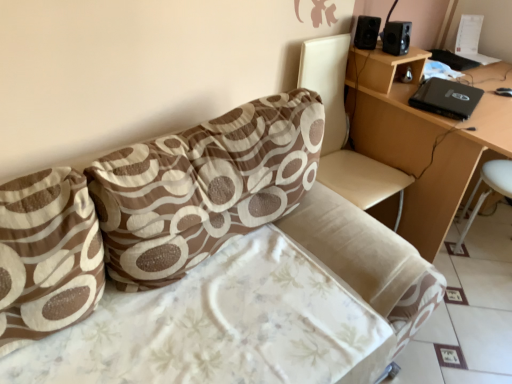
Where is `brown printed fabric pillow at upper center, the first pillow positioned from the right`? This screenshot has width=512, height=384. brown printed fabric pillow at upper center, the first pillow positioned from the right is located at coordinates (204, 187).

Identify the location of black matte laptop at upper right. (446, 98).

I want to click on beige leather swivel chair at upper right, so click(x=344, y=130).

Locate an element on the screen. The image size is (512, 384). light brown wooden table at upper right is located at coordinates (424, 139).

What do you see at coordinates (487, 191) in the screenshot? The width and height of the screenshot is (512, 384). I see `white plastic bar stool at lower right` at bounding box center [487, 191].

In order to click on white plastic bar stool at lower right in this screenshot , I will do `click(487, 191)`.

Find the location of a particular element. brown fabric couch at center is located at coordinates (205, 263).

Is black plastic speaker at upper right, which is the 1th speaker in right-to-left order, looking in the opposite direction of black matte speaker at upper right, which is the first speaker from left to right?

Yes.

Is black plastic speaker at upper right, placed as the 2th speaker when sorted from left to right, bigger than black matte speaker at upper right, which is the 2th speaker in right-to-left order?

No, black plastic speaker at upper right, placed as the 2th speaker when sorted from left to right, is not bigger than black matte speaker at upper right, which is the 2th speaker in right-to-left order.

Based on the photo, which object is closer to the camera, black plastic speaker at upper right, placed as the 2th speaker when sorted from left to right, or black matte speaker at upper right, which is the 2th speaker in right-to-left order?

black plastic speaker at upper right, placed as the 2th speaker when sorted from left to right, is closer to the camera.

From the picture: Considering the relative sizes of black plastic speaker at upper right, placed as the 2th speaker when sorted from left to right, and black matte speaker at upper right, which is the first speaker from left to right, in the image provided, is black plastic speaker at upper right, placed as the 2th speaker when sorted from left to right, taller than black matte speaker at upper right, which is the first speaker from left to right,?

Indeed, black plastic speaker at upper right, placed as the 2th speaker when sorted from left to right, has a greater height compared to black matte speaker at upper right, which is the first speaker from left to right.

Who is more distant, beige leather swivel chair at upper right or brown printed fabric pillow at left, positioned as the second pillow in right-to-left order?

beige leather swivel chair at upper right is behind.

Is beige leather swivel chair at upper right bigger than brown printed fabric pillow at left, the 1th pillow positioned from the left?

Yes, beige leather swivel chair at upper right is bigger than brown printed fabric pillow at left, the 1th pillow positioned from the left.

How many degrees apart are the facing directions of beige leather swivel chair at upper right and brown printed fabric pillow at left, the 1th pillow positioned from the left?

There is a 0.87-degree angle between the facing directions of beige leather swivel chair at upper right and brown printed fabric pillow at left, the 1th pillow positioned from the left.

Between point (322, 98) and point (45, 234), which one is positioned in front?

Positioned in front is point (45, 234).

Which of these two, brown fabric couch at center or brown printed fabric pillow at upper center, placed as the 2th pillow when sorted from left to right, is bigger?

With larger size is brown fabric couch at center.

Consider the image. Considering the sizes of objects brown fabric couch at center and brown printed fabric pillow at upper center, placed as the 2th pillow when sorted from left to right, in the image provided, who is wider, brown fabric couch at center or brown printed fabric pillow at upper center, placed as the 2th pillow when sorted from left to right,?

brown fabric couch at center is wider.

Is brown fabric couch at center facing towards brown printed fabric pillow at upper center, the first pillow positioned from the right?

No, brown fabric couch at center is not oriented towards brown printed fabric pillow at upper center, the first pillow positioned from the right.

Measure the distance from brown fabric couch at center to brown printed fabric pillow at upper center, the first pillow positioned from the right.

brown fabric couch at center is 4.00 inches away from brown printed fabric pillow at upper center, the first pillow positioned from the right.

From a real-world perspective, between black matte speaker at upper right, which is the 2th speaker in right-to-left order, and beige leather swivel chair at upper right, who is vertically lower?

beige leather swivel chair at upper right is physically lower.

Is black matte speaker at upper right, which is the 2th speaker in right-to-left order, at the left side of beige leather swivel chair at upper right?

Incorrect, black matte speaker at upper right, which is the 2th speaker in right-to-left order, is not on the left side of beige leather swivel chair at upper right.

From a real-world perspective, which speaker is the 1st one above the beige leather swivel chair at upper right? Please provide its 2D coordinates.

[(367, 32)]

From the image's perspective, is black matte speaker at upper right, which is the 2th speaker in right-to-left order, above or below beige leather swivel chair at upper right?

Based on their image positions, black matte speaker at upper right, which is the 2th speaker in right-to-left order, is located above beige leather swivel chair at upper right.

Which object is positioned more to the left, brown printed fabric pillow at left, positioned as the second pillow in right-to-left order, or black plastic speaker at upper right, placed as the 2th speaker when sorted from left to right?

Positioned to the left is brown printed fabric pillow at left, positioned as the second pillow in right-to-left order.

From the image's perspective, between brown printed fabric pillow at left, positioned as the second pillow in right-to-left order, and black plastic speaker at upper right, which is the 1th speaker in right-to-left order, who is located below?

brown printed fabric pillow at left, positioned as the second pillow in right-to-left order.

Considering the relative sizes of brown printed fabric pillow at left, the 1th pillow positioned from the left, and black plastic speaker at upper right, which is the 1th speaker in right-to-left order, in the image provided, is brown printed fabric pillow at left, the 1th pillow positioned from the left, wider than black plastic speaker at upper right, which is the 1th speaker in right-to-left order,?

Correct, the width of brown printed fabric pillow at left, the 1th pillow positioned from the left, exceeds that of black plastic speaker at upper right, which is the 1th speaker in right-to-left order.

From the image's perspective, which pillow is the 2nd one below the black plastic speaker at upper right, which is the 1th speaker in right-to-left order? Please provide its 2D coordinates.

[(47, 255)]

Choose the correct answer: Is light brown wooden table at upper right inside black plastic speaker at upper right, placed as the 2th speaker when sorted from left to right, or outside it?

light brown wooden table at upper right is spatially situated outside black plastic speaker at upper right, placed as the 2th speaker when sorted from left to right.

How many degrees apart are the facing directions of light brown wooden table at upper right and black plastic speaker at upper right, which is the 1th speaker in right-to-left order?

light brown wooden table at upper right and black plastic speaker at upper right, which is the 1th speaker in right-to-left order, are facing 0.249 degrees away from each other.

Considering the sizes of light brown wooden table at upper right and black plastic speaker at upper right, placed as the 2th speaker when sorted from left to right, in the image, is light brown wooden table at upper right wider or thinner than black plastic speaker at upper right, placed as the 2th speaker when sorted from left to right,?

Considering their sizes, light brown wooden table at upper right looks broader than black plastic speaker at upper right, placed as the 2th speaker when sorted from left to right.

From a real-world perspective, which is physically below, light brown wooden table at upper right or black plastic speaker at upper right, placed as the 2th speaker when sorted from left to right?

light brown wooden table at upper right.

Between black matte laptop at upper right and brown printed fabric pillow at left, the 1th pillow positioned from the left, which one has larger width?

With larger width is black matte laptop at upper right.

There is a black matte laptop at upper right. Where is `the 2nd pillow below it (from the image's perspective)`? The height and width of the screenshot is (384, 512). the 2nd pillow below it (from the image's perspective) is located at coordinates (47, 255).

What's the angular difference between black matte laptop at upper right and brown printed fabric pillow at left, the 1th pillow positioned from the left,'s facing directions?

There is a 16.2-degree angle between the facing directions of black matte laptop at upper right and brown printed fabric pillow at left, the 1th pillow positioned from the left.

Does point (466, 104) appear closer or farther from the camera than point (0, 335)?

Clearly, point (466, 104) is more distant from the camera than point (0, 335).

Find the location of a particular element. speaker below the black matte speaker at upper right, which is the 2th speaker in right-to-left order (from the image's perspective) is located at coordinates (396, 37).

From a real-world perspective, count 1st pillows upward from the beige leather swivel chair at upper right and point to it. Please provide its 2D coordinates.

[(47, 255)]

Which object lies further to the anchor point brown printed fabric pillow at upper center, placed as the 2th pillow when sorted from left to right, beige leather swivel chair at upper right or brown printed fabric pillow at left, positioned as the second pillow in right-to-left order?

Based on the image, beige leather swivel chair at upper right appears to be further to brown printed fabric pillow at upper center, placed as the 2th pillow when sorted from left to right.

Based on their spatial positions, is beige leather swivel chair at upper right or white plastic bar stool at lower right closer to brown printed fabric pillow at left, the 1th pillow positioned from the left?

Based on the image, beige leather swivel chair at upper right appears to be nearer to brown printed fabric pillow at left, the 1th pillow positioned from the left.

Looking at the image, which one is located further to beige leather swivel chair at upper right, black matte laptop at upper right or brown printed fabric pillow at upper center, the first pillow positioned from the right?

The object further to beige leather swivel chair at upper right is brown printed fabric pillow at upper center, the first pillow positioned from the right.

When comparing their distances from black plastic speaker at upper right, which is the 1th speaker in right-to-left order, does black matte speaker at upper right, which is the first speaker from left to right, or beige leather swivel chair at upper right seem further?

beige leather swivel chair at upper right lies further to black plastic speaker at upper right, which is the 1th speaker in right-to-left order, than the other object.

Estimate the real-world distances between objects in this image. Which object is further from black plastic speaker at upper right, placed as the 2th speaker when sorted from left to right, black matte speaker at upper right, which is the 2th speaker in right-to-left order, or brown printed fabric pillow at left, positioned as the second pillow in right-to-left order?

Among the two, brown printed fabric pillow at left, positioned as the second pillow in right-to-left order, is located further to black plastic speaker at upper right, placed as the 2th speaker when sorted from left to right.

Estimate the real-world distances between objects in this image. Which object is closer to brown printed fabric pillow at left, the 1th pillow positioned from the left, black matte laptop at upper right or brown printed fabric pillow at upper center, the first pillow positioned from the right?

Based on the image, brown printed fabric pillow at upper center, the first pillow positioned from the right, appears to be nearer to brown printed fabric pillow at left, the 1th pillow positioned from the left.

Estimate the real-world distances between objects in this image. Which object is closer to brown printed fabric pillow at left, the 1th pillow positioned from the left, brown printed fabric pillow at upper center, placed as the 2th pillow when sorted from left to right, or black matte laptop at upper right?

brown printed fabric pillow at upper center, placed as the 2th pillow when sorted from left to right.

Looking at the image, which one is located further to white plastic bar stool at lower right, brown printed fabric pillow at upper center, placed as the 2th pillow when sorted from left to right, or black matte speaker at upper right, which is the first speaker from left to right?

Based on the image, brown printed fabric pillow at upper center, placed as the 2th pillow when sorted from left to right, appears to be further to white plastic bar stool at lower right.

Find the location of a particular element. This screenshot has width=512, height=384. swivel chair between brown fabric couch at center and black plastic speaker at upper right, which is the 1th speaker in right-to-left order, along the z-axis is located at coordinates (344, 130).

In order to click on swivel chair between brown fabric couch at center and black matte speaker at upper right, which is the 2th speaker in right-to-left order, from front to back in this screenshot , I will do `click(344, 130)`.

You are a GUI agent. You are given a task and a screenshot of the screen. Output one action in this format:
    pyautogui.click(x=<x>, y=<y>)
    Task: Click on the pillow between brown printed fabric pillow at left, the 1th pillow positioned from the left, and black matte speaker at upper right, which is the 2th speaker in right-to-left order, in the front-back direction
    This screenshot has height=384, width=512.
    Given the screenshot: What is the action you would take?
    pyautogui.click(x=204, y=187)

Locate an element on the screen. pillow between brown printed fabric pillow at left, the 1th pillow positioned from the left, and beige leather swivel chair at upper right, in the horizontal direction is located at coordinates (204, 187).